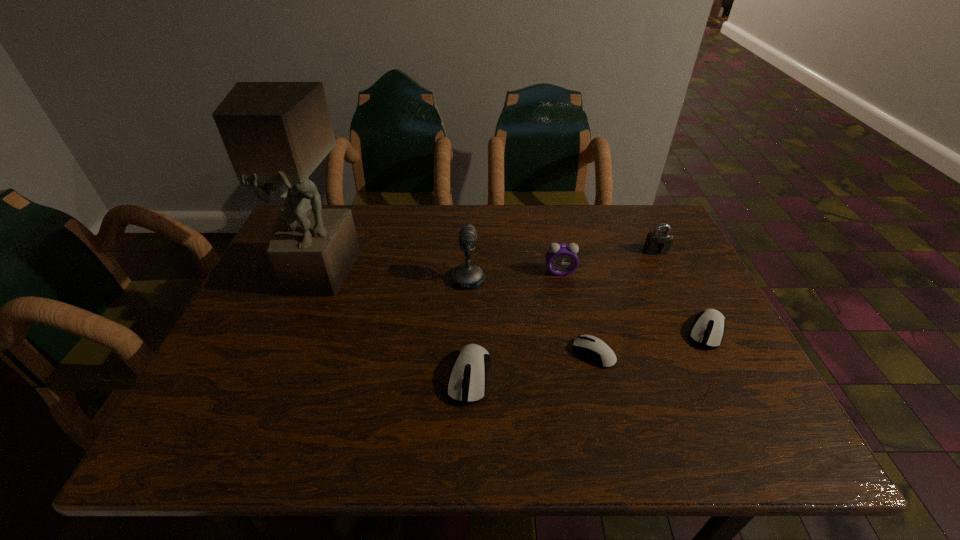
This screenshot has height=540, width=960. Find the location of `free space that satisfies the following two spatial constraints: 1. on the front-facing side of the microphone; 2. on the right side of the third shortest object`. free space that satisfies the following two spatial constraints: 1. on the front-facing side of the microphone; 2. on the right side of the third shortest object is located at coordinates (465, 376).

Find the location of a particular element. This screenshot has width=960, height=540. free spot that satisfies the following two spatial constraints: 1. at the front of the padlock near the keyhole; 2. on the right side of the second shortest mouse is located at coordinates (694, 332).

Find the location of `free region that satisfies the following two spatial constraints: 1. on the front-facing side of the tallest object; 2. on the left side of the shortest mouse`. free region that satisfies the following two spatial constraints: 1. on the front-facing side of the tallest object; 2. on the left side of the shortest mouse is located at coordinates (287, 353).

In order to click on free location that satisfies the following two spatial constraints: 1. on the front-facing side of the sixth shortest object; 2. on the left side of the leftmost mouse in this screenshot , I will do `click(465, 376)`.